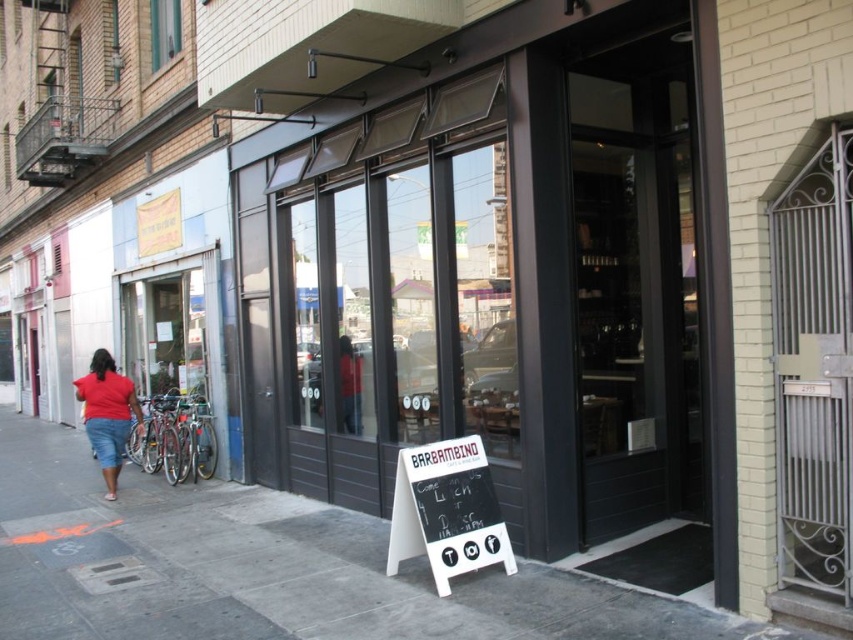
Question: Does gray concrete sidewalk at lower center appear under white wood sign at center?

Choices:
 (A) yes
 (B) no

Answer: (A)

Question: Is matte black storefront at center wider than gray concrete sidewalk at lower center?

Choices:
 (A) yes
 (B) no

Answer: (B)

Question: Which of the following is the farthest from the observer?

Choices:
 (A) white wood sign at center
 (B) gray concrete sidewalk at lower center
 (C) clear glass window at upper left
 (D) matte red shirt at left

Answer: (C)

Question: Is white wood sign at center thinner than clear glass window at upper left?

Choices:
 (A) no
 (B) yes

Answer: (A)

Question: Considering the real-world distances, which object is farthest from the white wood sign at center?

Choices:
 (A) clear glass window at upper left
 (B) matte red shirt at left
 (C) gray concrete sidewalk at lower center

Answer: (A)

Question: Which point is farther to the camera?

Choices:
 (A) (341, 336)
 (B) (436, 465)
 (C) (509, 364)

Answer: (A)